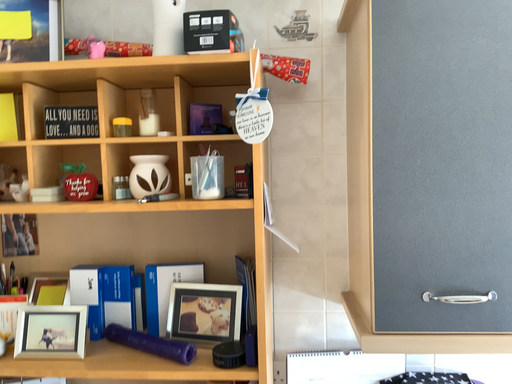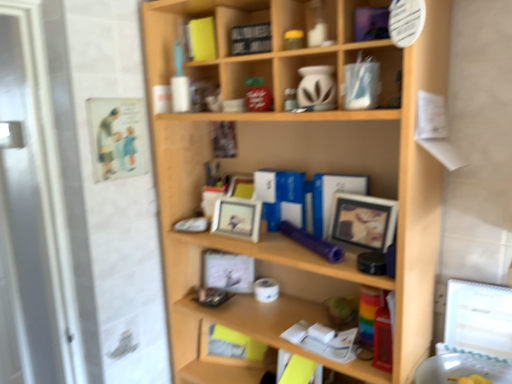
Question: Which way did the camera rotate in the video?

Choices:
 (A) rotated right
 (B) rotated left

Answer: (B)